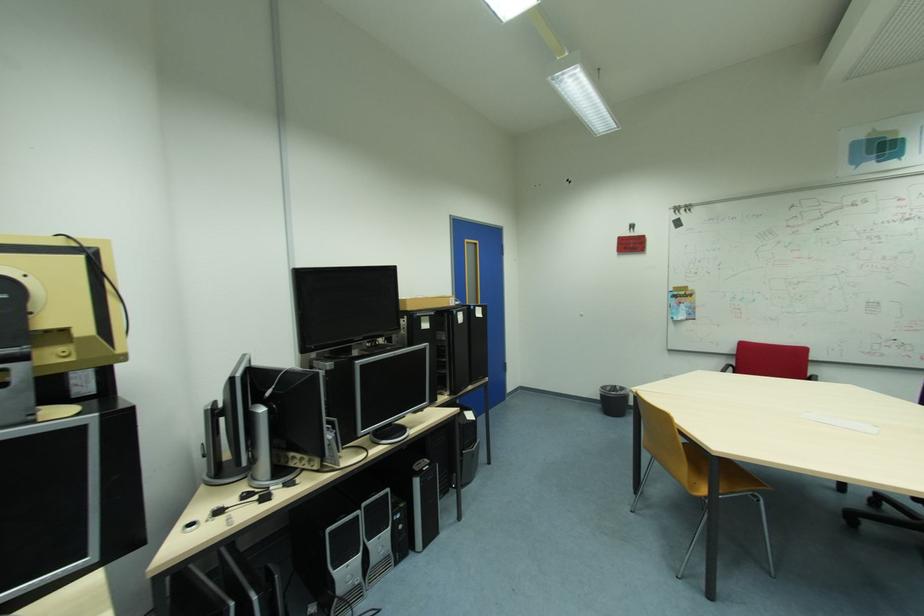
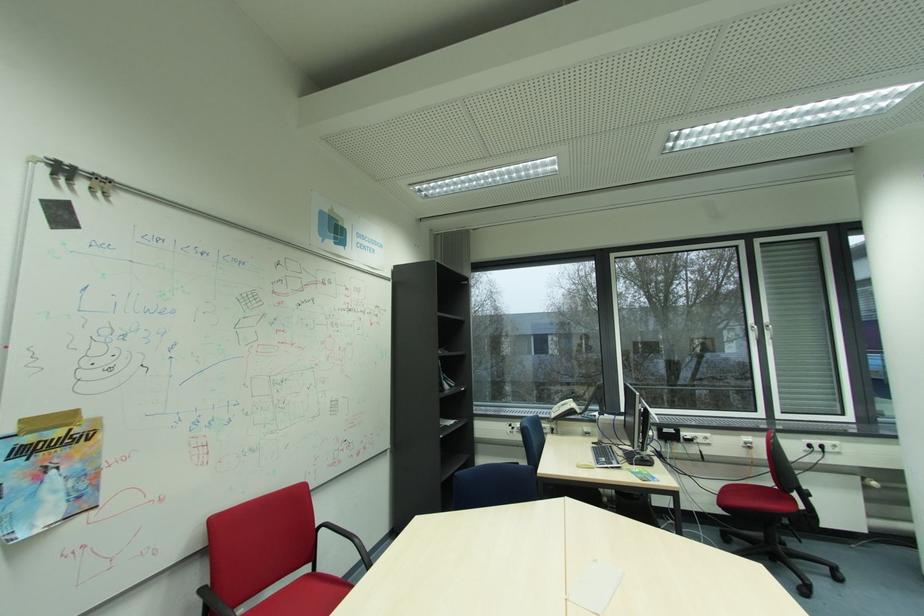
The point at (739, 367) is marked in the first image. Where is the corresponding point in the second image?

(212, 589)